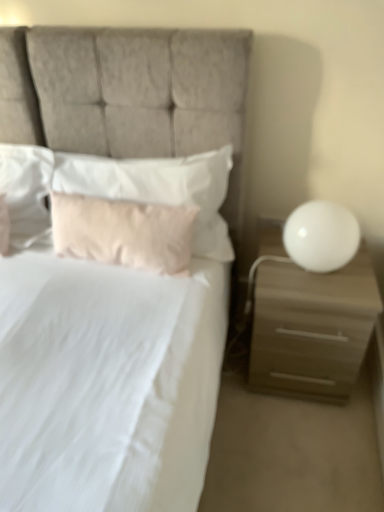
Locate an element on the screen. white soft pillow at upper left, which is the 3th pillow from right to left is located at coordinates (26, 192).

The width and height of the screenshot is (384, 512). What do you see at coordinates (123, 232) in the screenshot? I see `pink fabric pillow at center, which is the 2th pillow in left-to-right order` at bounding box center [123, 232].

Find the location of a particular element. The height and width of the screenshot is (512, 384). pink fabric pillow at center, which is the 2th pillow in left-to-right order is located at coordinates (123, 232).

Image resolution: width=384 pixels, height=512 pixels. I want to click on white glossy sphere at right, so click(321, 236).

Where is `matte beige nightstand at right`? matte beige nightstand at right is located at coordinates pyautogui.click(x=309, y=322).

From the image's perspective, which pillow is the 1st one above the pink fabric pillow at center, which is the 2th pillow in left-to-right order? Please provide its 2D coordinates.

[(159, 188)]

Between pink fabric pillow at center, acting as the second pillow starting from the right, and soft pink pillow at center, which is the 3th pillow in left-to-right order, which one has larger size?

soft pink pillow at center, which is the 3th pillow in left-to-right order.

Is pink fabric pillow at center, acting as the second pillow starting from the right, outside of soft pink pillow at center, which is the 3th pillow in left-to-right order?

pink fabric pillow at center, acting as the second pillow starting from the right, lies outside soft pink pillow at center, which is the 3th pillow in left-to-right order,'s area.

Does pink fabric pillow at center, acting as the second pillow starting from the right, have a lesser width compared to soft pink pillow at center, which is the 3th pillow in left-to-right order?

Indeed, pink fabric pillow at center, acting as the second pillow starting from the right, has a lesser width compared to soft pink pillow at center, which is the 3th pillow in left-to-right order.

Does point (307, 240) come farther from viewer compared to point (197, 211)?

No, it is in front of (197, 211).

Is white glossy sphere at right bigger than pink fabric pillow at center, acting as the second pillow starting from the right?

Actually, white glossy sphere at right might be smaller than pink fabric pillow at center, acting as the second pillow starting from the right.

At what (x,y) coordinates should I click in order to perform the action: click on table lamp that appears in front of the pink fabric pillow at center, which is the 2th pillow in left-to-right order. Please return your answer as a coordinate pair (x, y). Looking at the image, I should click on (321, 236).

Considering the sizes of objects white glossy sphere at right and pink fabric pillow at center, which is the 2th pillow in left-to-right order, in the image provided, who is taller, white glossy sphere at right or pink fabric pillow at center, which is the 2th pillow in left-to-right order,?

Standing taller between the two is pink fabric pillow at center, which is the 2th pillow in left-to-right order.

Looking at this image, is white soft pillow at upper left, placed as the first pillow when sorted from left to right, with matte beige nightstand at right?

white soft pillow at upper left, placed as the first pillow when sorted from left to right, and matte beige nightstand at right are not in contact.

Considering the relative sizes of white soft pillow at upper left, which is the 3th pillow from right to left, and matte beige nightstand at right in the image provided, is white soft pillow at upper left, which is the 3th pillow from right to left, wider than matte beige nightstand at right?

No, white soft pillow at upper left, which is the 3th pillow from right to left, is not wider than matte beige nightstand at right.

You are a GUI agent. You are given a task and a screenshot of the screen. Output one action in this format:
    pyautogui.click(x=<x>, y=<y>)
    Task: Click on the nightstand located on the right of white soft pillow at upper left, placed as the first pillow when sorted from left to right
    
    Given the screenshot: What is the action you would take?
    coord(309,322)

Is white soft pillow at upper left, placed as the first pillow when sorted from left to right, behind matte beige nightstand at right?

Yes, the depth of white soft pillow at upper left, placed as the first pillow when sorted from left to right, is greater than that of matte beige nightstand at right.

Is white glossy sphere at right inside the boundaries of white soft pillow at upper left, placed as the first pillow when sorted from left to right, or outside?

white glossy sphere at right is spatially situated outside white soft pillow at upper left, placed as the first pillow when sorted from left to right.

Are white glossy sphere at right and white soft pillow at upper left, placed as the first pillow when sorted from left to right, far apart?

That's right, there is a large distance between white glossy sphere at right and white soft pillow at upper left, placed as the first pillow when sorted from left to right.

Looking at this image, from the image's perspective, which is below, white glossy sphere at right or white soft pillow at upper left, placed as the first pillow when sorted from left to right?

From the image's view, white glossy sphere at right is below.

Identify the location of table lamp in front of the white soft pillow at upper left, which is the 3th pillow from right to left. Image resolution: width=384 pixels, height=512 pixels. (321, 236).

Considering the positions of points (103, 249) and (24, 217), is point (103, 249) farther from camera compared to point (24, 217)?

No, it is in front of (24, 217).

Is pink fabric pillow at center, which is the 2th pillow in left-to-right order, in contact with white soft pillow at upper left, which is the 3th pillow from right to left?

They are not placed beside each other.

Is pink fabric pillow at center, which is the 2th pillow in left-to-right order, inside or outside of white soft pillow at upper left, which is the 3th pillow from right to left?

pink fabric pillow at center, which is the 2th pillow in left-to-right order, is not enclosed by white soft pillow at upper left, which is the 3th pillow from right to left.

Locate an element on the screen. This screenshot has width=384, height=512. the 2nd pillow behind the pink fabric pillow at center, acting as the second pillow starting from the right is located at coordinates [26, 192].

Where is `the 2nd pillow above the white glossy sphere at right (from the image's perspective)`? the 2nd pillow above the white glossy sphere at right (from the image's perspective) is located at coordinates (159, 188).

Is white glossy sphere at right at the back of soft pink pillow at center, which is the 3th pillow in left-to-right order?

No, soft pink pillow at center, which is the 3th pillow in left-to-right order, is not facing away from white glossy sphere at right.

Is soft pink pillow at center, arranged as the 1th pillow when viewed from the right, at the right side of white glossy sphere at right?

No, soft pink pillow at center, arranged as the 1th pillow when viewed from the right, is not to the right of white glossy sphere at right.

Which of these two, matte beige nightstand at right or pink fabric pillow at center, which is the 2th pillow in left-to-right order, stands taller?

matte beige nightstand at right is taller.

In the image, is matte beige nightstand at right on the left side or the right side of pink fabric pillow at center, which is the 2th pillow in left-to-right order?

Based on their positions, matte beige nightstand at right is located to the right of pink fabric pillow at center, which is the 2th pillow in left-to-right order.

From the image's perspective, is matte beige nightstand at right above pink fabric pillow at center, acting as the second pillow starting from the right?

No, from the image's perspective, matte beige nightstand at right is not on top of pink fabric pillow at center, acting as the second pillow starting from the right.

From a real-world perspective, who is located lower, matte beige nightstand at right or pink fabric pillow at center, which is the 2th pillow in left-to-right order?

From a 3D spatial view, matte beige nightstand at right is below.

Where is `pillow below the soft pink pillow at center, arranged as the 1th pillow when viewed from the right (from the image's perspective)`? pillow below the soft pink pillow at center, arranged as the 1th pillow when viewed from the right (from the image's perspective) is located at coordinates click(x=123, y=232).

You are a GUI agent. You are given a task and a screenshot of the screen. Output one action in this format:
    pyautogui.click(x=<x>, y=<y>)
    Task: Click on the table lamp lying in front of the pink fabric pillow at center, acting as the second pillow starting from the right
    
    Given the screenshot: What is the action you would take?
    pyautogui.click(x=321, y=236)

Considering their positions, is white soft pillow at upper left, placed as the first pillow when sorted from left to right, positioned closer to soft pink pillow at center, arranged as the 1th pillow when viewed from the right, than matte beige nightstand at right?

→ Based on the image, white soft pillow at upper left, placed as the first pillow when sorted from left to right, appears to be nearer to soft pink pillow at center, arranged as the 1th pillow when viewed from the right.

When comparing their distances from soft pink pillow at center, arranged as the 1th pillow when viewed from the right, does white glossy sphere at right or white soft pillow at upper left, which is the 3th pillow from right to left, seem further?

Among the two, white glossy sphere at right is located further to soft pink pillow at center, arranged as the 1th pillow when viewed from the right.

Which object lies further to the anchor point white soft pillow at upper left, placed as the first pillow when sorted from left to right, pink fabric pillow at center, which is the 2th pillow in left-to-right order, or white glossy sphere at right?

white glossy sphere at right lies further to white soft pillow at upper left, placed as the first pillow when sorted from left to right, than the other object.

Which object lies further to the anchor point matte beige nightstand at right, soft pink pillow at center, arranged as the 1th pillow when viewed from the right, or pink fabric pillow at center, acting as the second pillow starting from the right?

Among the two, pink fabric pillow at center, acting as the second pillow starting from the right, is located further to matte beige nightstand at right.

Which object lies further to the anchor point white glossy sphere at right, soft pink pillow at center, arranged as the 1th pillow when viewed from the right, or matte beige nightstand at right?

Based on the image, soft pink pillow at center, arranged as the 1th pillow when viewed from the right, appears to be further to white glossy sphere at right.

From the image, which object appears to be nearer to matte beige nightstand at right, white soft pillow at upper left, placed as the first pillow when sorted from left to right, or soft pink pillow at center, arranged as the 1th pillow when viewed from the right?

soft pink pillow at center, arranged as the 1th pillow when viewed from the right, is positioned closer to the anchor matte beige nightstand at right.

When comparing their distances from white soft pillow at upper left, placed as the first pillow when sorted from left to right, does pink fabric pillow at center, acting as the second pillow starting from the right, or matte beige nightstand at right seem closer?

pink fabric pillow at center, acting as the second pillow starting from the right, is positioned closer to the anchor white soft pillow at upper left, placed as the first pillow when sorted from left to right.

Consider the image. When comparing their distances from white soft pillow at upper left, which is the 3th pillow from right to left, does white glossy sphere at right or pink fabric pillow at center, which is the 2th pillow in left-to-right order, seem further?

white glossy sphere at right is positioned further to the anchor white soft pillow at upper left, which is the 3th pillow from right to left.

Identify the location of table lamp between soft pink pillow at center, arranged as the 1th pillow when viewed from the right, and matte beige nightstand at right, in the horizontal direction. (321, 236).

The image size is (384, 512). Find the location of `pillow between white soft pillow at upper left, which is the 3th pillow from right to left, and soft pink pillow at center, which is the 3th pillow in left-to-right order`. pillow between white soft pillow at upper left, which is the 3th pillow from right to left, and soft pink pillow at center, which is the 3th pillow in left-to-right order is located at coordinates (123, 232).

Identify the location of pillow between pink fabric pillow at center, acting as the second pillow starting from the right, and white glossy sphere at right. click(159, 188).

You are a GUI agent. You are given a task and a screenshot of the screen. Output one action in this format:
    pyautogui.click(x=<x>, y=<y>)
    Task: Click on the table lamp located between white soft pillow at upper left, placed as the first pillow when sorted from left to right, and matte beige nightstand at right in the left-right direction
    The height and width of the screenshot is (512, 384).
    Given the screenshot: What is the action you would take?
    pyautogui.click(x=321, y=236)